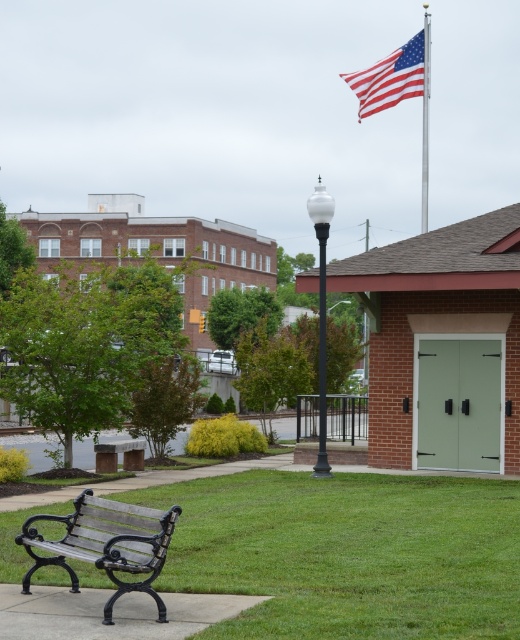
You are standing at the center of the walkway and want to place a new bench exactly at the point marked by point (394, 76). The existing black metal bench on the walkway is 1.5 meters long. Can the new bench be placed at that point without overlapping the existing bench?

The point (394, 76) marks the red white blue fabric flag at upper right, which is not the location of the existing black metal bench on the walkway. Therefore, placing the new bench at that point would not overlap with the existing bench.

You are a visitor in this outdoor area and want to sit on the black wrought iron bench at lower left. If you are currently standing near the metallic flag pole at upper right, which direction should you walk to reach the bench?

The black wrought iron bench at lower left is to the left of the metallic flag pole at upper right, so you should walk towards the left to reach it.